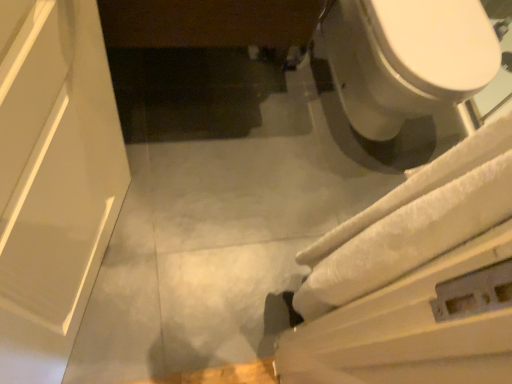
What do you see at coordinates (412, 222) in the screenshot? This screenshot has height=384, width=512. I see `white textured bath towel at right` at bounding box center [412, 222].

Locate an element on the screen. This screenshot has width=512, height=384. white textured bath towel at right is located at coordinates (412, 222).

What is the approximate width of white glossy toilet at upper right?

white glossy toilet at upper right is 26.08 inches in width.

What do you see at coordinates (405, 68) in the screenshot?
I see `white glossy toilet at upper right` at bounding box center [405, 68].

Where is `white glossy toilet at upper right`? The width and height of the screenshot is (512, 384). white glossy toilet at upper right is located at coordinates (405, 68).

You are a GUI agent. You are given a task and a screenshot of the screen. Output one action in this format:
    pyautogui.click(x=<x>, y=<y>)
    Task: Click on the white textured bath towel at right
    
    Given the screenshot: What is the action you would take?
    [412, 222]

Can you confirm if white glossy toilet at upper right is positioned to the left of white textured bath towel at right?

No, white glossy toilet at upper right is not to the left of white textured bath towel at right.

In the image, is white glossy toilet at upper right positioned in front of or behind white textured bath towel at right?

Visually, white glossy toilet at upper right is located behind white textured bath towel at right.

Which point is more forward, [358,134] or [379,205]?

Point [379,205]

Based on the photo, from the image's perspective, which one is positioned higher, white glossy toilet at upper right or white textured bath towel at right?

white glossy toilet at upper right appears higher in the image.

From a real-world perspective, is white glossy toilet at upper right over white textured bath towel at right?

Incorrect, from a real-world perspective, white glossy toilet at upper right is lower than white textured bath towel at right.

In the scene shown: Which of these two, white glossy toilet at upper right or white textured bath towel at right, is wider?

Wider between the two is white glossy toilet at upper right.

From their relative heights in the image, would you say white glossy toilet at upper right is taller or shorter than white textured bath towel at right?

Considering their sizes, white glossy toilet at upper right has more height than white textured bath towel at right.

Can you confirm if white glossy toilet at upper right is bigger than white textured bath towel at right?

Yes, white glossy toilet at upper right is bigger than white textured bath towel at right.

Is white glossy toilet at upper right positioned beyond the bounds of white textured bath towel at right?

white glossy toilet at upper right is positioned outside white textured bath towel at right.

Is the surface of white glossy toilet at upper right in direct contact with white textured bath towel at right?

white glossy toilet at upper right is not next to white textured bath towel at right, and they're not touching.

Consider the image. Is white textured bath towel at right at the back of white glossy toilet at upper right?

No.

How far apart are white glossy toilet at upper right and white textured bath towel at right?

27.29 inches.

In the image, there is a white textured bath towel at right. Identify the location of toilet above it (from the image's perspective). This screenshot has width=512, height=384. (405, 68).

Between white textured bath towel at right and white glossy toilet at upper right, which one appears on the right side from the viewer's perspective?

Positioned to the right is white glossy toilet at upper right.

Which is in front, white textured bath towel at right or white glossy toilet at upper right?

white textured bath towel at right is more forward.

Which point is more distant from viewer, (x=499, y=165) or (x=456, y=91)?

Positioned behind is point (x=456, y=91).

From the image's perspective, between white textured bath towel at right and white glossy toilet at upper right, who is located below?

white textured bath towel at right appears lower in the image.

From a real-world perspective, is white textured bath towel at right positioned above or below white glossy toilet at upper right?

Clearly, from a real-world perspective, white textured bath towel at right is above white glossy toilet at upper right.

Is white textured bath towel at right thinner than white glossy toilet at upper right?

Yes, white textured bath towel at right is thinner than white glossy toilet at upper right.

Can you confirm if white textured bath towel at right is taller than white glossy toilet at upper right?

No.

Considering the sizes of objects white textured bath towel at right and white glossy toilet at upper right in the image provided, who is smaller, white textured bath towel at right or white glossy toilet at upper right?

Smaller between the two is white textured bath towel at right.

Is white glossy toilet at upper right surrounded by white textured bath towel at right?

Actually, white glossy toilet at upper right is outside white textured bath towel at right.

Is white textured bath towel at right in contact with white glossy toilet at upper right?

No, white textured bath towel at right is not beside white glossy toilet at upper right.

Is white textured bath towel at right aimed at white glossy toilet at upper right?

No.

Can you tell me how much white textured bath towel at right and white glossy toilet at upper right differ in facing direction?

They differ by 175 degrees in their facing directions.

Locate an element on the screen. toilet behind the white textured bath towel at right is located at coordinates (405, 68).

Where is `bath towel in front of the white glossy toilet at upper right`? The image size is (512, 384). bath towel in front of the white glossy toilet at upper right is located at coordinates (412, 222).

At what (x,y) coordinates should I click in order to perform the action: click on toilet behind the white textured bath towel at right. Please return your answer as a coordinate pair (x, y). This screenshot has height=384, width=512. Looking at the image, I should click on (405, 68).